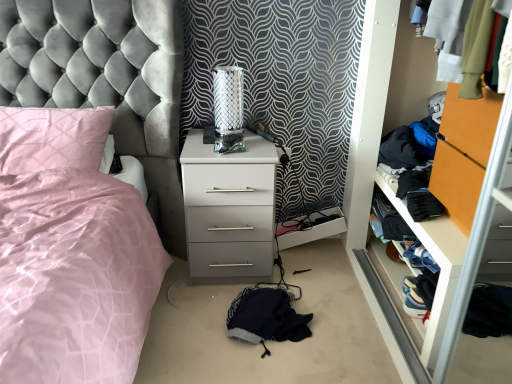
Where is `vacant space to the left of denim jeans at lower right, marked as the first clothing in a right-to-left arrangement`? The width and height of the screenshot is (512, 384). vacant space to the left of denim jeans at lower right, marked as the first clothing in a right-to-left arrangement is located at coordinates point(369,299).